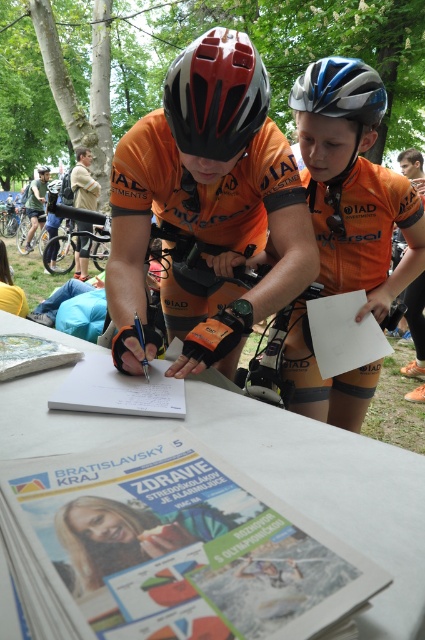
Question: Estimate the real-world distances between objects in this image. Which object is closer to the light brown leather jacket at upper left?

Choices:
 (A) red matte helmet at upper center
 (B) orange jersey at center

Answer: (B)

Question: Which object is farther from the camera taking this photo?

Choices:
 (A) matte black helmet at upper center
 (B) light brown leather jacket at upper left

Answer: (A)

Question: Which of the following is the closest to the observer?

Choices:
 (A) (82, 195)
 (B) (40, 216)
 (C) (311, 88)
 (D) (257, 195)

Answer: (D)

Question: Is orange jersey at center positioned before silver/glossy bicycle helmet at upper center?

Choices:
 (A) yes
 (B) no

Answer: (A)

Question: Is red matte helmet at upper center to the right of silver/glossy bicycle helmet at upper center from the viewer's perspective?

Choices:
 (A) no
 (B) yes

Answer: (A)

Question: Does red matte helmet at upper center have a greater width compared to light brown leather jacket at upper left?

Choices:
 (A) yes
 (B) no

Answer: (B)